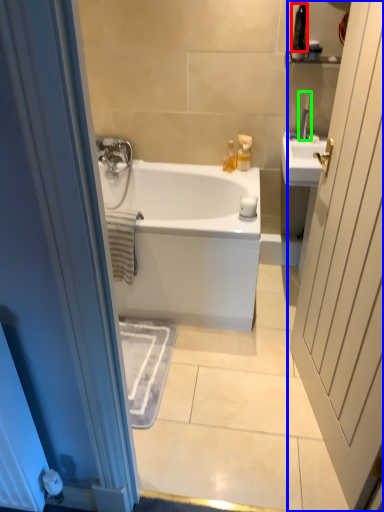
Question: Which object is the closest to the toiletry (highlighted by a red box)? Choose among these: door (highlighted by a blue box) or toiletry (highlighted by a green box).

Choices:
 (A) door
 (B) toiletry

Answer: (B)